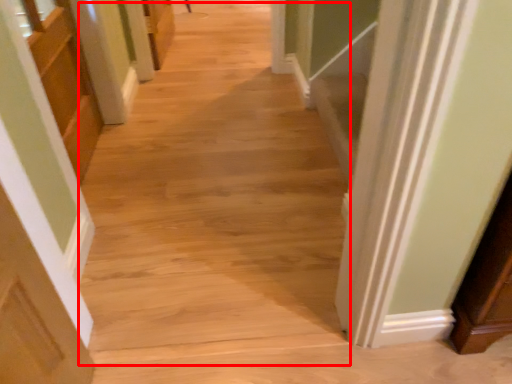
Question: From the image's perspective, considering the relative positions of aisle (annotated by the red box) and cabinetry in the image provided, where is aisle (annotated by the red box) located with respect to the staircase?

Choices:
 (A) above
 (B) below

Answer: (B)